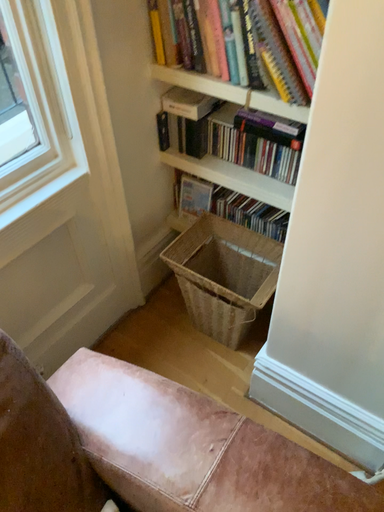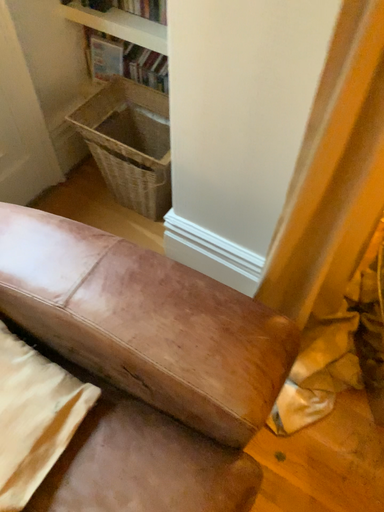
Question: How did the camera likely rotate when shooting the video?

Choices:
 (A) rotated upward
 (B) rotated downward

Answer: (B)